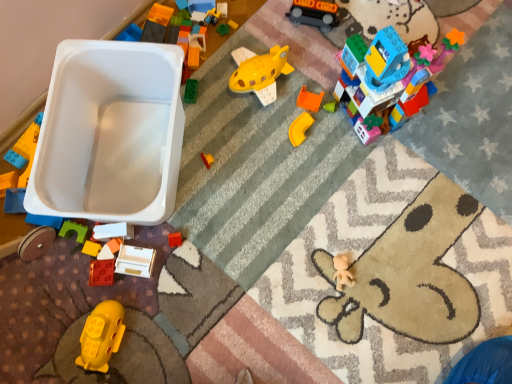
Question: Considering the relative sizes of matte white drawer at lower center, positioned as the 4th toy in right-to-left order, and yellow matte toy submarine at lower left, which is the 3th toy from left to right, in the image provided, is matte white drawer at lower center, positioned as the 4th toy in right-to-left order, smaller than yellow matte toy submarine at lower left, which is the 3th toy from left to right,?

Choices:
 (A) yes
 (B) no

Answer: (A)

Question: Does matte white drawer at lower center, positioned as the 4th toy in right-to-left order, turn towards yellow matte toy submarine at lower left, the 6th toy viewed from the right?

Choices:
 (A) yes
 (B) no

Answer: (B)

Question: From a real-world perspective, does matte white drawer at lower center, which ranks as the third toy in bottom-to-top order, sit lower than yellow matte toy submarine at lower left, which is the first toy from bottom to top?

Choices:
 (A) yes
 (B) no

Answer: (A)

Question: Is the depth of matte white drawer at lower center, which ranks as the third toy in bottom-to-top order, greater than that of yellow matte toy submarine at lower left, which is counted as the eighth toy, starting from the top?

Choices:
 (A) no
 (B) yes

Answer: (B)

Question: Can you confirm if matte white drawer at lower center, the 6th toy from the top, is positioned to the right of yellow matte toy submarine at lower left, which is the 3th toy from left to right?

Choices:
 (A) yes
 (B) no

Answer: (A)

Question: Relative to yellow matte plastic corner piece at center-right, positioned as the third toy in top-to-bottom order, is rubber brick at lower left, marked as the 2th toy in a left-to-right arrangement, in front or behind?

Choices:
 (A) front
 (B) behind

Answer: (A)

Question: Considering the positions of rubber brick at lower left, marked as the 2th toy in a left-to-right arrangement, and yellow matte plastic corner piece at center-right, acting as the sixth toy starting from the bottom, in the image, is rubber brick at lower left, marked as the 2th toy in a left-to-right arrangement, taller or shorter than yellow matte plastic corner piece at center-right, acting as the sixth toy starting from the bottom,?

Choices:
 (A) short
 (B) tall

Answer: (A)

Question: Looking at the image, does rubber brick at lower left, the second toy positioned from the bottom, seem bigger or smaller compared to yellow matte plastic corner piece at center-right, acting as the third toy starting from the right?

Choices:
 (A) big
 (B) small

Answer: (B)

Question: In terms of width, does rubber brick at lower left, marked as the 2th toy in a left-to-right arrangement, look wider or thinner when compared to yellow matte plastic corner piece at center-right, positioned as the third toy in top-to-bottom order?

Choices:
 (A) wide
 (B) thin

Answer: (A)

Question: Is rubberized orange block at lower left, positioned as the eighth toy in right-to-left order, situated inside white matte block at lower left, which is the fifth toy from right to left, or outside?

Choices:
 (A) outside
 (B) inside

Answer: (A)

Question: Considering the positions of rubberized orange block at lower left, acting as the fourth toy starting from the bottom, and white matte block at lower left, arranged as the fifth toy when ordered from the bottom, in the image, is rubberized orange block at lower left, acting as the fourth toy starting from the bottom, taller or shorter than white matte block at lower left, arranged as the fifth toy when ordered from the bottom,?

Choices:
 (A) tall
 (B) short

Answer: (B)

Question: Looking at their shapes, would you say rubberized orange block at lower left, the 1th toy positioned from the left, is wider or thinner than white matte block at lower left, which ranks as the 4th toy in left-to-right order?

Choices:
 (A) thin
 (B) wide

Answer: (A)

Question: From a real-world perspective, is rubberized orange block at lower left, acting as the fifth toy starting from the top, physically located above or below white matte block at lower left, which ranks as the 4th toy in left-to-right order?

Choices:
 (A) above
 (B) below

Answer: (B)

Question: Is point (314, 14) closer or farther from the camera than point (103, 331)?

Choices:
 (A) farther
 (B) closer

Answer: (A)

Question: From a real-world perspective, is shiny black train at upper center, arranged as the 1th toy when viewed from the top, above or below yellow matte toy submarine at lower left, which is counted as the eighth toy, starting from the top?

Choices:
 (A) above
 (B) below

Answer: (B)